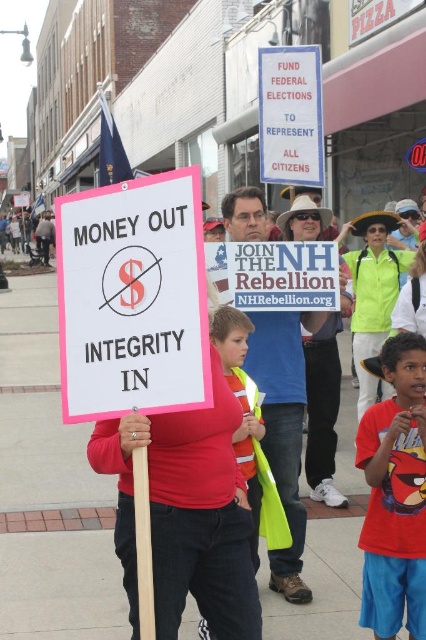
Question: Which of these objects is positioned closest to the blue denim jeans at center?

Choices:
 (A) angry bird t-shirt at center
 (B) pink plastic sign at center
 (C) white paper sign at upper center

Answer: (A)

Question: Does angry bird t-shirt at center have a smaller size compared to white paper sign at upper center?

Choices:
 (A) yes
 (B) no

Answer: (B)

Question: Which is farther from the white paper sign at upper center?

Choices:
 (A) white paper sign at center
 (B) angry bird t-shirt at center
 (C) pink plastic sign at center

Answer: (C)

Question: Does angry bird t-shirt at center appear under white paper sign at upper center?

Choices:
 (A) yes
 (B) no

Answer: (A)

Question: Is pink plastic sign at center bigger than white paper sign at center?

Choices:
 (A) no
 (B) yes

Answer: (B)

Question: Among these points, which one is farthest from the camera?

Choices:
 (A) (69, 339)
 (B) (310, 273)
 (C) (391, 497)

Answer: (B)